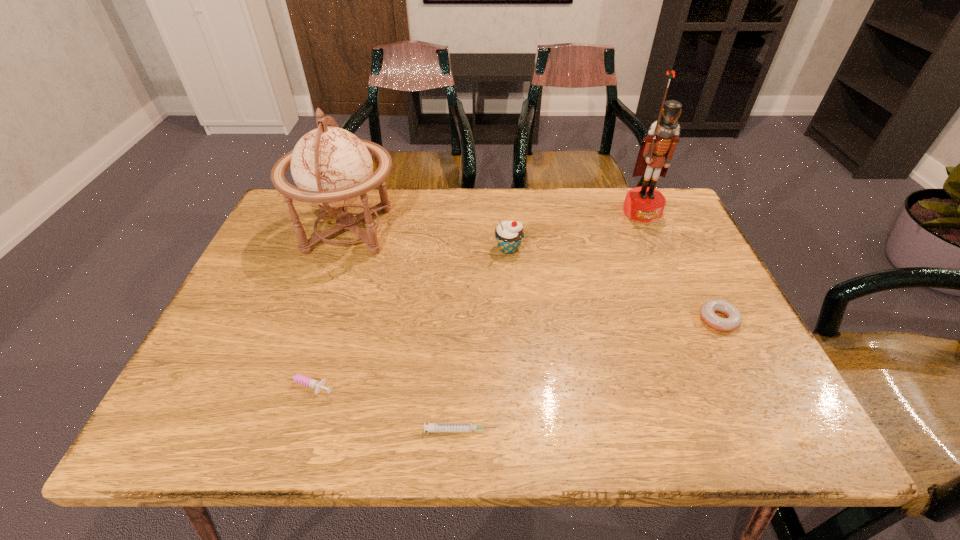
I want to click on nutcracker, so click(645, 204).

At what (x,y) coordinates should I click in order to perform the action: click on the fifth shortest object. Please return your answer as a coordinate pair (x, y). The width and height of the screenshot is (960, 540). Looking at the image, I should click on (332, 167).

Identify the location of the third tallest object. (509, 235).

In order to click on cupcake in this screenshot , I will do `click(509, 235)`.

Identify the location of the fourth tallest object. (734, 318).

I want to click on the third nearest object, so click(734, 318).

This screenshot has height=540, width=960. Identify the location of the farther syringe. (309, 382).

Locate an element on the screen. the fifth farthest object is located at coordinates (309, 382).

The image size is (960, 540). Identify the location of the nearer syringe. (431, 427).

Locate an element on the screen. The height and width of the screenshot is (540, 960). the nearest object is located at coordinates (431, 427).